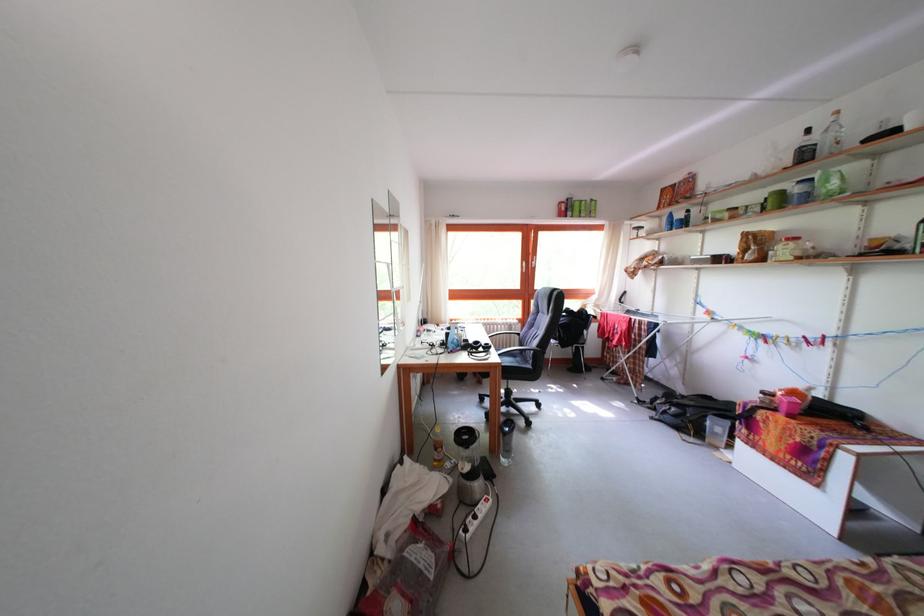
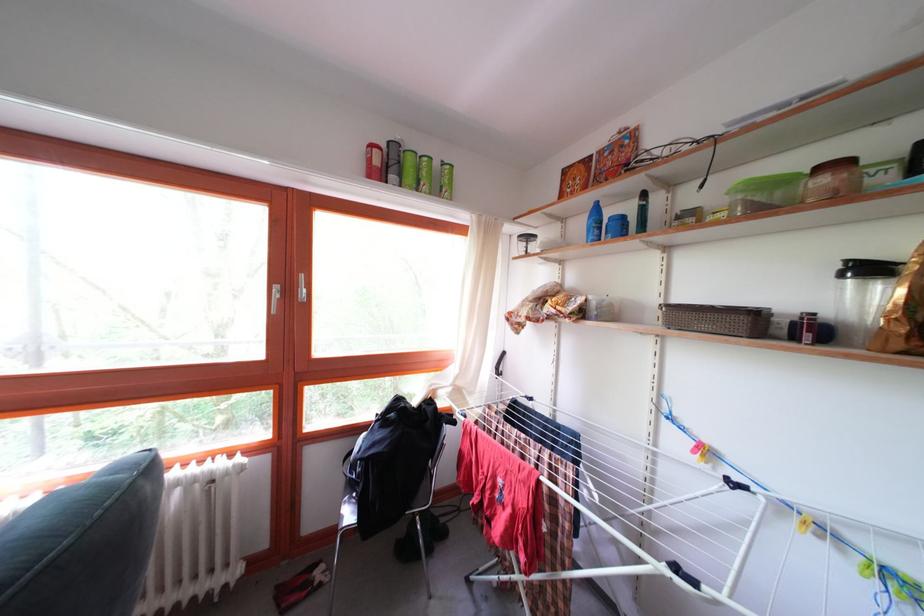
Locate, in the second image, the point that corresponds to [675,217] in the first image.

(598, 204)